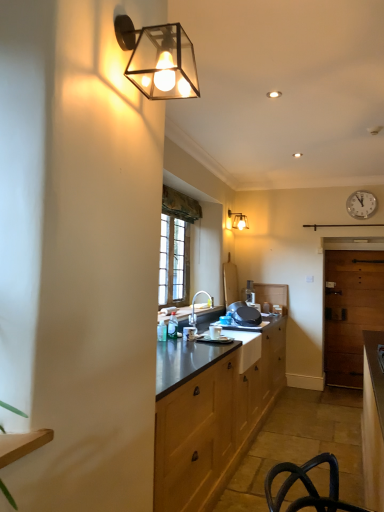
Question: From a real-world perspective, relative to wooden door at right, is matte silver faucet at center vertically above or below?

Choices:
 (A) below
 (B) above

Answer: (B)

Question: From the image's perspective, is matte silver faucet at center located above or below wooden door at right?

Choices:
 (A) below
 (B) above

Answer: (B)

Question: Estimate the real-world distances between objects in this image. Which object is farther from the matte silver faucet at center?

Choices:
 (A) wooden door at right
 (B) white plastic clock at upper right
 (C) matte black wall sconce at upper left, marked as the first lamp in a front-to-back arrangement
 (D) matte glass wall sconce at upper center, which is the first lamp from back to front

Answer: (C)

Question: Which is nearer to the matte silver faucet at center?

Choices:
 (A) matte glass wall sconce at upper center, the 2th lamp from the front
 (B) wooden door at right
 (C) white plastic clock at upper right
 (D) matte black wall sconce at upper left, which is the 2th lamp from right to left

Answer: (A)